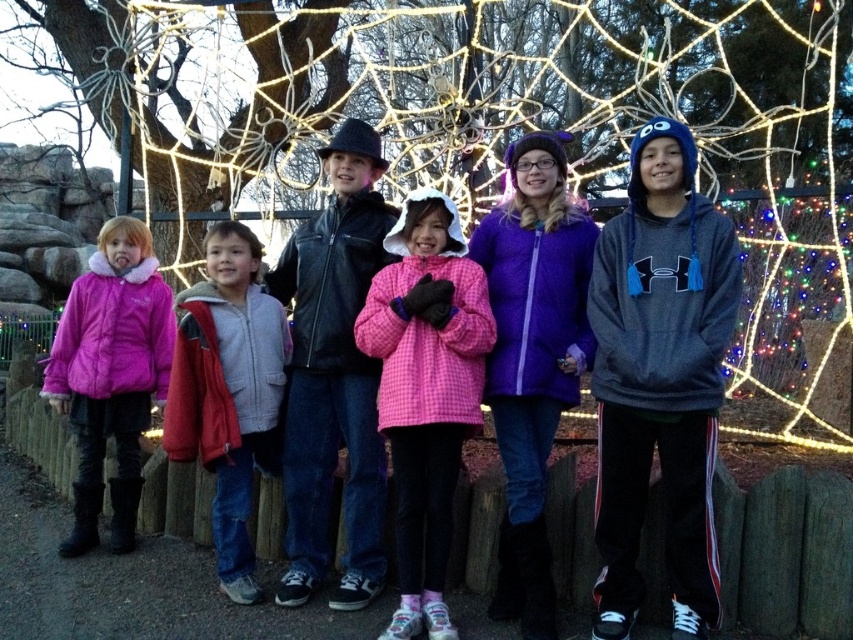
Between point (651, 161) and point (824, 493), which one is positioned in front?

Point (824, 493) is more forward.

Is point (415, 440) positioned before point (585, 502)?

No, it is not.

Describe the element at coordinates (664, 518) in the screenshot. I see `pink fleece jacket at center` at that location.

The height and width of the screenshot is (640, 853). Find the location of `pink fleece jacket at center`. pink fleece jacket at center is located at coordinates (664, 518).

Does pink checkered jacket at center have a greater width compared to pink puffy jacket at left?

No, pink checkered jacket at center is not wider than pink puffy jacket at left.

Can you confirm if pink checkered jacket at center is smaller than pink puffy jacket at left?

Incorrect, pink checkered jacket at center is not smaller in size than pink puffy jacket at left.

Which is in front, point (479, 273) or point (77, 468)?

Positioned in front is point (479, 273).

You are a GUI agent. You are given a task and a screenshot of the screen. Output one action in this format:
    pyautogui.click(x=<x>, y=<y>)
    Task: Click on the pink checkered jacket at center
    The image size is (853, 640).
    Given the screenshot: What is the action you would take?
    point(426,390)

Can you confirm if wooden fence at lower center is smaller than pink puffy jacket at left?

Yes.

Consider the image. Who is lower down, wooden fence at lower center or pink puffy jacket at left?

wooden fence at lower center

Locate an element on the screen. This screenshot has height=640, width=853. wooden fence at lower center is located at coordinates (786, 552).